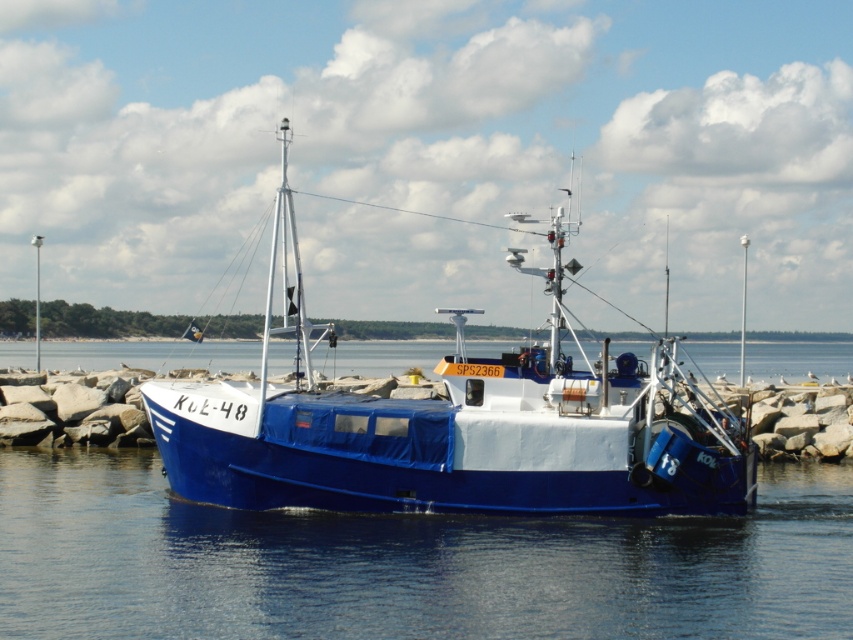
Between blue smooth water at center and blue matte boat at center, which one appears on the left side from the viewer's perspective?

blue smooth water at center is more to the left.

Can you confirm if blue smooth water at center is thinner than blue matte boat at center?

In fact, blue smooth water at center might be wider than blue matte boat at center.

This screenshot has height=640, width=853. Identify the location of blue smooth water at center. (407, 563).

Find the location of a particular element. The height and width of the screenshot is (640, 853). blue smooth water at center is located at coordinates (407, 563).